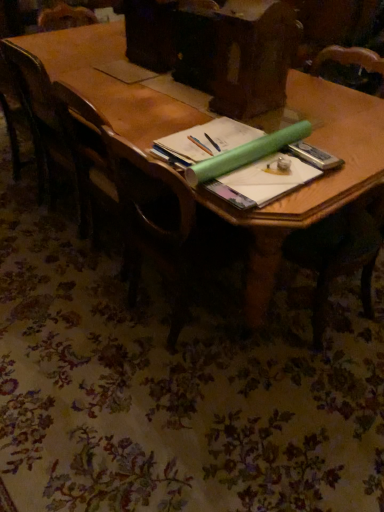
Question: Is wooden table at center positioned far away from wooden chair at center, the 1th chair viewed from the right?

Choices:
 (A) no
 (B) yes

Answer: (A)

Question: Is wooden table at center positioned in front of wooden chair at center, the 1th chair viewed from the right?

Choices:
 (A) no
 (B) yes

Answer: (B)

Question: Does wooden table at center have a lesser height compared to wooden chair at center, which appears as the second chair when viewed from the back?

Choices:
 (A) yes
 (B) no

Answer: (A)

Question: Is wooden table at center turned away from wooden chair at center, the 1th chair viewed from the right?

Choices:
 (A) yes
 (B) no

Answer: (B)

Question: Can you confirm if wooden table at center is positioned to the right of wooden chair at center, which appears as the first chair when viewed from the front?

Choices:
 (A) no
 (B) yes

Answer: (A)

Question: From the image's perspective, is wooden chair at left, positioned as the 2th chair in front-to-back order, above or below wooden chair at center, which appears as the second chair when viewed from the back?

Choices:
 (A) below
 (B) above

Answer: (B)

Question: Is wooden chair at left, the first chair in the back-to-front sequence, inside or outside of wooden chair at center, which is the second chair in left-to-right order?

Choices:
 (A) inside
 (B) outside

Answer: (B)

Question: From a real-world perspective, is wooden chair at left, positioned as the 2th chair in front-to-back order, above or below wooden chair at center, which appears as the second chair when viewed from the back?

Choices:
 (A) above
 (B) below

Answer: (A)

Question: In terms of width, does wooden chair at left, the 2th chair from the right, look wider or thinner when compared to wooden chair at center, which appears as the first chair when viewed from the front?

Choices:
 (A) thin
 (B) wide

Answer: (B)

Question: From a real-world perspective, is wooden table at center physically located above or below wooden chair at left, the first chair in the back-to-front sequence?

Choices:
 (A) above
 (B) below

Answer: (B)

Question: Considering their positions, is wooden table at center located in front of or behind wooden chair at left, the first chair in the back-to-front sequence?

Choices:
 (A) front
 (B) behind

Answer: (A)

Question: From the image's perspective, is wooden table at center located above or below wooden chair at left, the first chair in the back-to-front sequence?

Choices:
 (A) above
 (B) below

Answer: (B)

Question: Does point (304, 204) appear closer or farther from the camera than point (36, 174)?

Choices:
 (A) farther
 (B) closer

Answer: (B)

Question: Visually, is wooden chair at center, the 1th chair viewed from the right, positioned to the left or to the right of wooden chair at left, positioned as the 2th chair in front-to-back order?

Choices:
 (A) left
 (B) right

Answer: (B)

Question: Considering the positions of wooden chair at center, which is the second chair in left-to-right order, and wooden chair at left, the first chair in the back-to-front sequence, in the image, is wooden chair at center, which is the second chair in left-to-right order, taller or shorter than wooden chair at left, the first chair in the back-to-front sequence,?

Choices:
 (A) tall
 (B) short

Answer: (B)